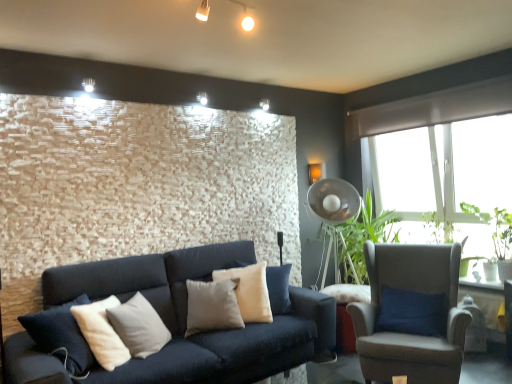
What do you see at coordinates (438, 228) in the screenshot? I see `green leafy plant at right, placed as the 1th plant when sorted from front to back` at bounding box center [438, 228].

The height and width of the screenshot is (384, 512). I want to click on light beige fabric armchair at right, so click(411, 314).

At what (x,y) coordinates should I click in order to perform the action: click on green leafy plant at right, placed as the 1th plant when sorted from front to back. Please return your answer as a coordinate pair (x, y). The width and height of the screenshot is (512, 384). Looking at the image, I should click on (438, 228).

Measure the distance from light beige fabric armchair at right to green leafy plant at right, positioned as the 2th plant in back-to-front order.

light beige fabric armchair at right and green leafy plant at right, positioned as the 2th plant in back-to-front order, are 1.16 meters apart from each other.

Is light beige fabric armchair at right inside the boundaries of green leafy plant at right, placed as the 1th plant when sorted from front to back, or outside?

light beige fabric armchair at right cannot be found inside green leafy plant at right, placed as the 1th plant when sorted from front to back.

Considering the sizes of objects light beige fabric armchair at right and green leafy plant at right, placed as the 1th plant when sorted from front to back, in the image provided, who is taller, light beige fabric armchair at right or green leafy plant at right, placed as the 1th plant when sorted from front to back,?

Standing taller between the two is light beige fabric armchair at right.

Is light beige fabric armchair at right far from green leafy plant at right, placed as the 1th plant when sorted from front to back?

Yes.

From a real-world perspective, is green leafy plant at right, marked as the second plant in a front-to-back arrangement, positioned above or below light beige fabric armchair at right?

From a real-world perspective, green leafy plant at right, marked as the second plant in a front-to-back arrangement, is physically above light beige fabric armchair at right.

Considering the sizes of objects green leafy plant at right, the 1th plant from the back, and light beige fabric armchair at right in the image provided, who is wider, green leafy plant at right, the 1th plant from the back, or light beige fabric armchair at right?

light beige fabric armchair at right is wider.

Would you say green leafy plant at right, the 1th plant from the back, contains light beige fabric armchair at right?

No, light beige fabric armchair at right is located outside of green leafy plant at right, the 1th plant from the back.

Between green leafy plant at right, the 1th plant from the back, and light beige fabric armchair at right, which one has less height?

With less height is green leafy plant at right, the 1th plant from the back.

Does light beige fabric armchair at right lie behind green leafy plant at right, marked as the second plant in a front-to-back arrangement?

That is False.

Which is behind, point (392, 327) or point (448, 241)?

The point (448, 241) is more distant.

I want to click on the 2nd plant positioned above the light beige fabric armchair at right (from a real-world perspective), so click(438, 228).

Is green leafy plant at right, placed as the 1th plant when sorted from front to back, positioned in front of metallic silver fan at center-right?

Yes.

Is metallic silver fan at center-right a part of green leafy plant at right, placed as the 1th plant when sorted from front to back?

No, metallic silver fan at center-right is not a part of green leafy plant at right, placed as the 1th plant when sorted from front to back.

Which plant is the 2nd one when counting from the front of the metallic silver fan at center-right? Please provide its 2D coordinates.

[(438, 228)]

Considering the sizes of green leafy plant at right, placed as the 1th plant when sorted from front to back, and metallic silver fan at center-right in the image, is green leafy plant at right, placed as the 1th plant when sorted from front to back, bigger or smaller than metallic silver fan at center-right?

green leafy plant at right, placed as the 1th plant when sorted from front to back, is smaller than metallic silver fan at center-right.

Is beige fabric pillow at center directly adjacent to metallic silver fan at center-right?

No.

Can you confirm if beige fabric pillow at center is positioned to the right of metallic silver fan at center-right?

No.

Consider the image. Does beige fabric pillow at center turn towards metallic silver fan at center-right?

No, beige fabric pillow at center is not oriented towards metallic silver fan at center-right.

Which of these two, beige fabric pillow at center or metallic silver fan at center-right, is smaller?

beige fabric pillow at center.

Based on the photo, which of these two, green leafy plant at right, the 1th plant from the back, or green leafy plant at right, placed as the 1th plant when sorted from front to back, stands shorter?

Standing shorter between the two is green leafy plant at right, the 1th plant from the back.

Can you see green leafy plant at right, marked as the second plant in a front-to-back arrangement, touching green leafy plant at right, placed as the 1th plant when sorted from front to back?

Yes, green leafy plant at right, marked as the second plant in a front-to-back arrangement, and green leafy plant at right, placed as the 1th plant when sorted from front to back, clearly make contact.

From the image's perspective, would you say green leafy plant at right, the 1th plant from the back, is shown under green leafy plant at right, placed as the 1th plant when sorted from front to back?

Incorrect, from the image's perspective, green leafy plant at right, the 1th plant from the back, is higher than green leafy plant at right, placed as the 1th plant when sorted from front to back.

What's the angular difference between green leafy plant at right, the 1th plant from the back, and green leafy plant at right, placed as the 1th plant when sorted from front to back,'s facing directions?

The angular difference between green leafy plant at right, the 1th plant from the back, and green leafy plant at right, placed as the 1th plant when sorted from front to back, is 4.7 degrees.

In the scene shown: Is green leafy plant at right, the 1th plant from the back, with beige fabric pillow at center?

They are not placed beside each other.

How different are the orientations of green leafy plant at right, marked as the second plant in a front-to-back arrangement, and beige fabric pillow at center in degrees?

The angular difference between green leafy plant at right, marked as the second plant in a front-to-back arrangement, and beige fabric pillow at center is 133 degrees.

From the image's perspective, who appears lower, green leafy plant at right, marked as the second plant in a front-to-back arrangement, or beige fabric pillow at center?

beige fabric pillow at center appears lower in the image.

Considering the points (445, 235) and (194, 327), which point is behind, point (445, 235) or point (194, 327)?

The point (445, 235) is behind.

Starting from the light beige fabric armchair at right, which plant is the 2nd one to the right? Please provide its 2D coordinates.

[(438, 228)]

Locate an element on the screen. chair that appears below the green leafy plant at right, marked as the second plant in a front-to-back arrangement (from a real-world perspective) is located at coordinates (411, 314).

From the image, which object appears to be nearer to light beige fabric armchair at right, beige fabric pillow at center or green leafy plant at right, marked as the second plant in a front-to-back arrangement?

beige fabric pillow at center is closer to light beige fabric armchair at right.

From the image, which object appears to be nearer to light beige fabric armchair at right, metallic silver fan at center-right or green leafy plant at right, the 1th plant from the back?

metallic silver fan at center-right is positioned closer to the anchor light beige fabric armchair at right.

Considering their positions, is beige fabric pillow at center positioned closer to green leafy plant at right, positioned as the 2th plant in back-to-front order, than light beige fabric armchair at right?

Based on the image, light beige fabric armchair at right appears to be nearer to green leafy plant at right, positioned as the 2th plant in back-to-front order.

Looking at the image, which one is located closer to green leafy plant at right, the 1th plant from the back, green leafy plant at right, placed as the 1th plant when sorted from front to back, or beige fabric pillow at center?

Based on the image, green leafy plant at right, placed as the 1th plant when sorted from front to back, appears to be nearer to green leafy plant at right, the 1th plant from the back.

From the picture: From the image, which object appears to be farther from green leafy plant at right, the 1th plant from the back, metallic silver fan at center-right or beige fabric pillow at center?

beige fabric pillow at center lies further to green leafy plant at right, the 1th plant from the back, than the other object.

Which object lies further to the anchor point green leafy plant at right, marked as the second plant in a front-to-back arrangement, light beige fabric armchair at right or green leafy plant at right, placed as the 1th plant when sorted from front to back?

Based on the image, light beige fabric armchair at right appears to be further to green leafy plant at right, marked as the second plant in a front-to-back arrangement.

When comparing their distances from metallic silver fan at center-right, does beige fabric pillow at center or light beige fabric armchair at right seem further?

beige fabric pillow at center lies further to metallic silver fan at center-right than the other object.

Considering their positions, is green leafy plant at right, marked as the second plant in a front-to-back arrangement, positioned closer to green leafy plant at right, placed as the 1th plant when sorted from front to back, than metallic silver fan at center-right?

green leafy plant at right, marked as the second plant in a front-to-back arrangement, is closer to green leafy plant at right, placed as the 1th plant when sorted from front to back.

Where is `plant between light beige fabric armchair at right and green leafy plant at right, the 1th plant from the back, from front to back`? This screenshot has width=512, height=384. plant between light beige fabric armchair at right and green leafy plant at right, the 1th plant from the back, from front to back is located at coordinates point(438,228).

Identify the location of mechanical fan situated between beige fabric pillow at center and green leafy plant at right, marked as the second plant in a front-to-back arrangement, from left to right. This screenshot has height=384, width=512. (334, 214).

Where is `plant between beige fabric pillow at center and green leafy plant at right, positioned as the 2th plant in back-to-front order`? The image size is (512, 384). plant between beige fabric pillow at center and green leafy plant at right, positioned as the 2th plant in back-to-front order is located at coordinates (438, 228).

Image resolution: width=512 pixels, height=384 pixels. What are the coordinates of `plant between metallic silver fan at center-right and green leafy plant at right, positioned as the 2th plant in back-to-front order, in the horizontal direction` in the screenshot? It's located at tap(438, 228).